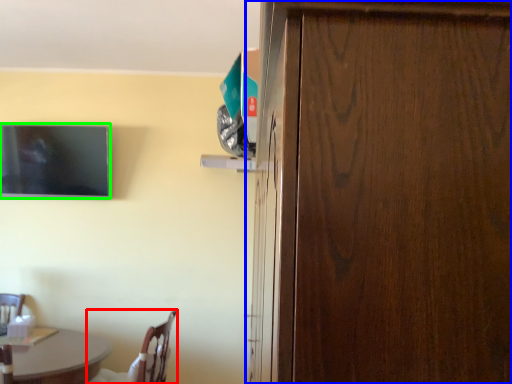
Question: Which is farther away from chair (highlighted by a red box)? door (highlighted by a blue box) or television (highlighted by a green box)?

Choices:
 (A) door
 (B) television

Answer: (A)